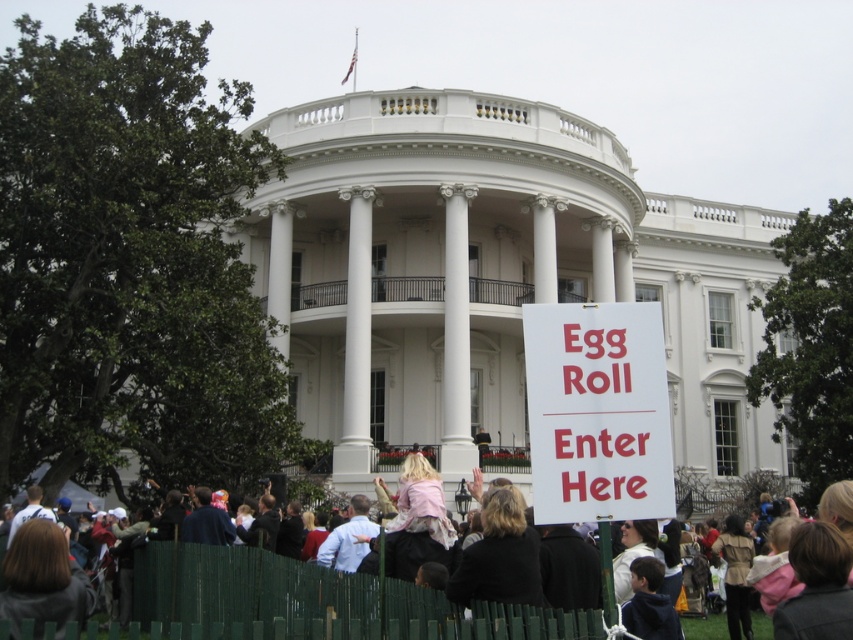
You are a visitor at the White House and see the white paper sign at center and the green wooden fence at lower center. Which object is closer to you?

The white paper sign at center is closer to you because the green wooden fence at lower center is behind it.

You are a visitor at the White House and see the white paper sign at center and the blonde hair at center in the crowd. Which object is taller?

The white paper sign at center is taller than the blonde hair at center.

You are a photographer trying to capture a clear shot of the blonde hair at center and the green wooden fence at lower center. Based on their positions, which object is closer to the camera?

The blonde hair at center is closer to the camera because it is positioned below the green wooden fence at lower center, indicating it is in a lower and more forward spatial plane.